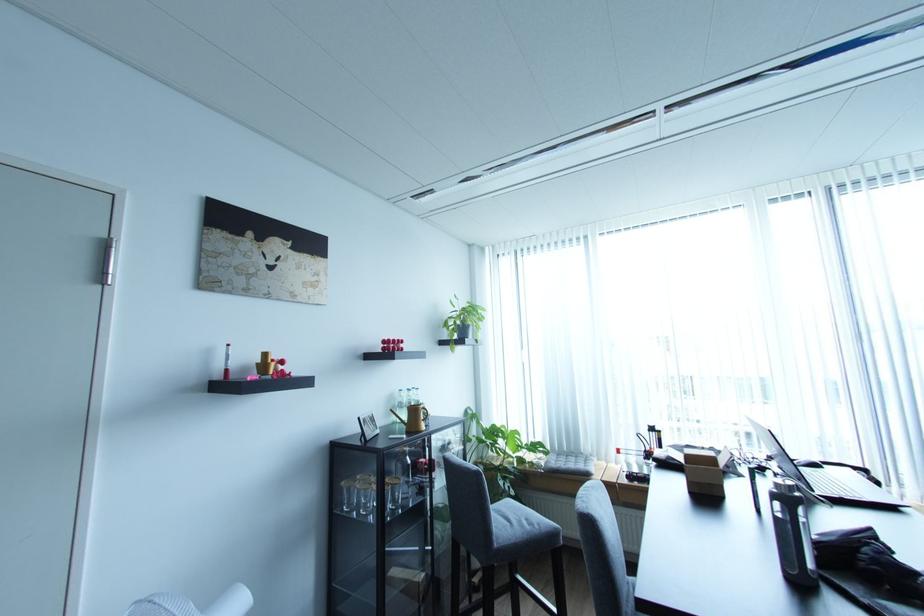
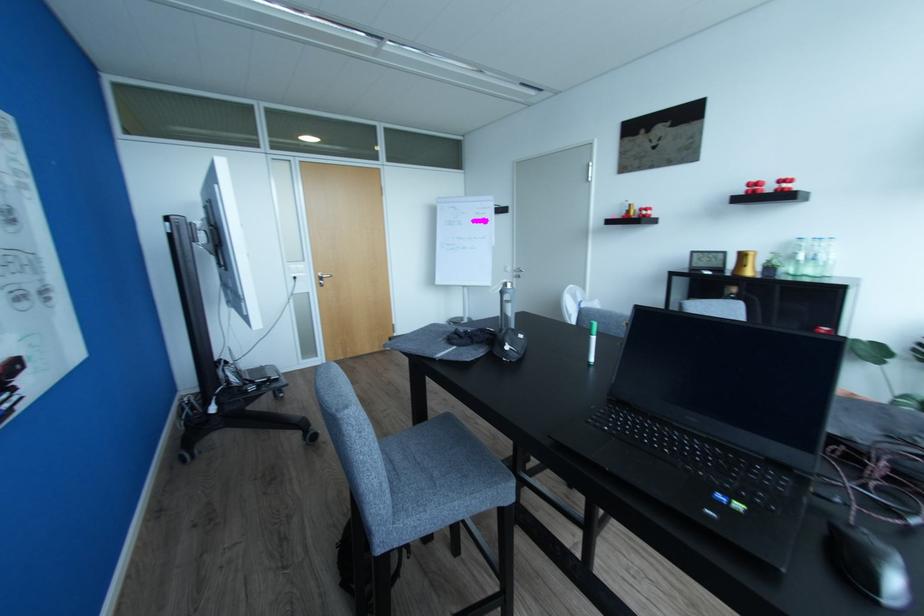
Where in the second image is the point corresponding to pixel 427 421 from the first image?

(750, 267)